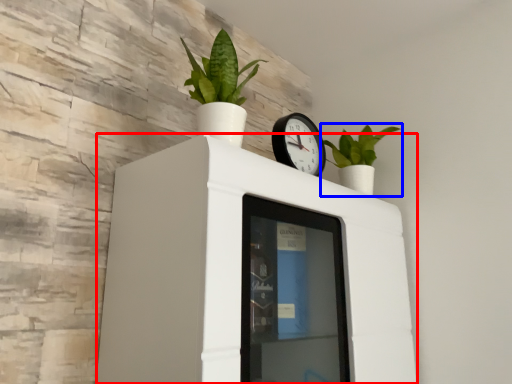
Question: Which point is closer to the camera, furniture (highlighted by a red box) or houseplant (highlighted by a blue box)?

Choices:
 (A) furniture
 (B) houseplant

Answer: (A)